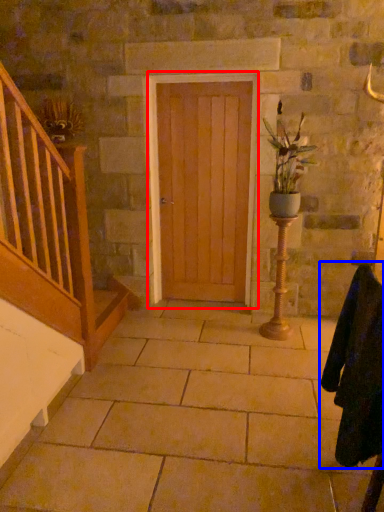
Question: Which of the following is the closest to the observer, door (highlighted by a red box) or robe (highlighted by a blue box)?

Choices:
 (A) door
 (B) robe

Answer: (B)